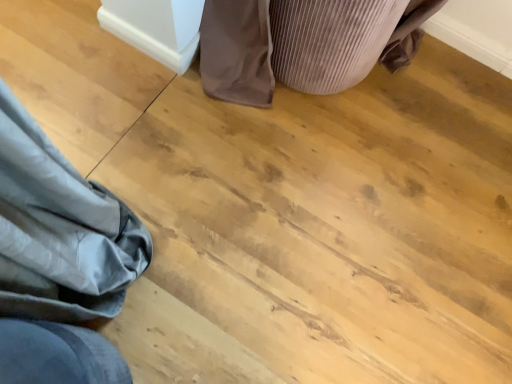
Where is `free space in front of velvet beige bean bag chair at upper right`? The width and height of the screenshot is (512, 384). free space in front of velvet beige bean bag chair at upper right is located at coordinates click(x=287, y=162).